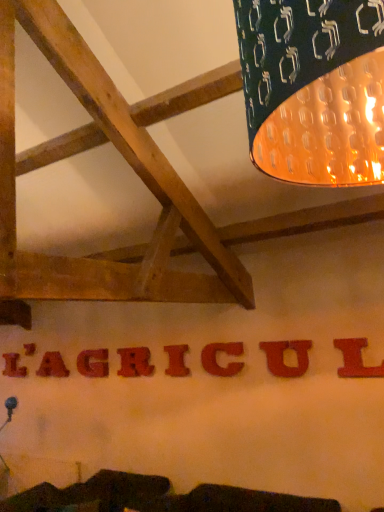
Question: In terms of size, does matte red letter u at center, which is the 2th letter from right to left, appear bigger or smaller than matte red letter at center, which is the seventh letter in left-to-right order?

Choices:
 (A) small
 (B) big

Answer: (A)

Question: Does point (269, 346) appear closer or farther from the camera than point (240, 346)?

Choices:
 (A) farther
 (B) closer

Answer: (B)

Question: Estimate the real-world distances between objects in this image. Which object is farther from the brushed metal letter l at lower left, the ninth letter from the right?

Choices:
 (A) red matte letter at center, acting as the seventh letter starting from the front
 (B) matte red letter at center, positioned as the 6th letter in left-to-right order
 (C) red matte letter l at center, acting as the 1th letter starting from the front
 (D) matte red letter g at center, acting as the 4th letter starting from the back
 (E) matte red letter at center, arranged as the 7th letter when viewed from the back

Answer: (C)

Question: Estimate the real-world distances between objects in this image. Which object is farther from the matte red letter at center, which appears as the sixth letter when viewed from the back?

Choices:
 (A) red matte letter at center, which appears as the 3th letter when viewed from the left
 (B) matte red letter at center, which ranks as the 3th letter in right-to-left order
 (C) red matte letter l at center, the ninth letter from the left
 (D) matte red letter g at center, placed as the sixth letter when sorted from right to left
 (E) brushed metal letter at center, the 8th letter from the front

Answer: (E)